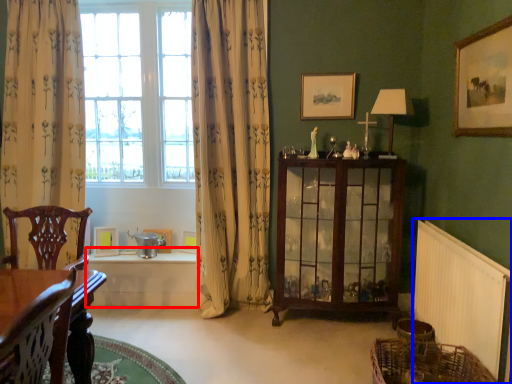
Question: Which object appears closest to the camera in this image, table (highlighted by a red box) or radiator (highlighted by a blue box)?

Choices:
 (A) table
 (B) radiator

Answer: (B)